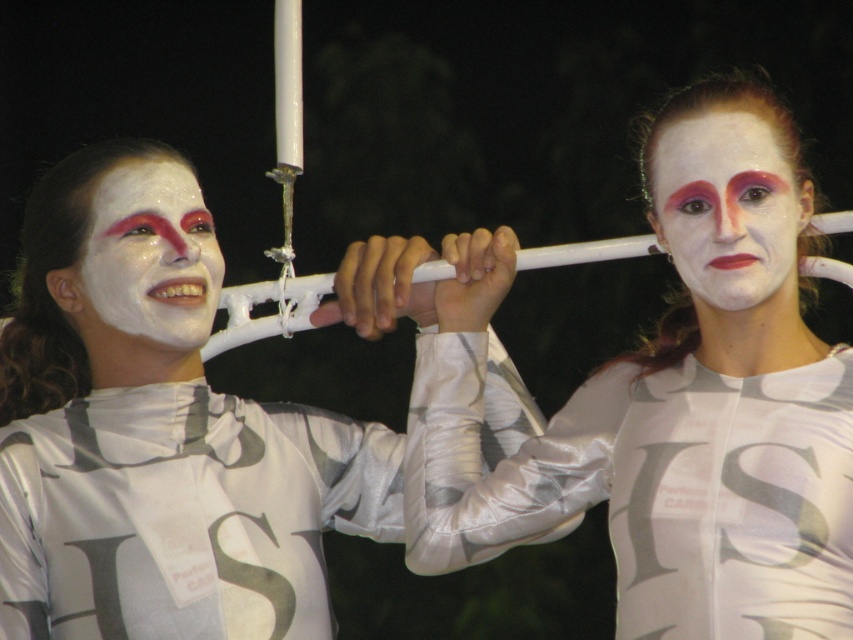
You are a photographer adjusting your camera settings to capture the scene. Which object, the white satin costume at upper center or the white matte face at left, is located lower in the image?

The white satin costume at upper center is positioned under the white matte face at left, meaning it is lower in the image.